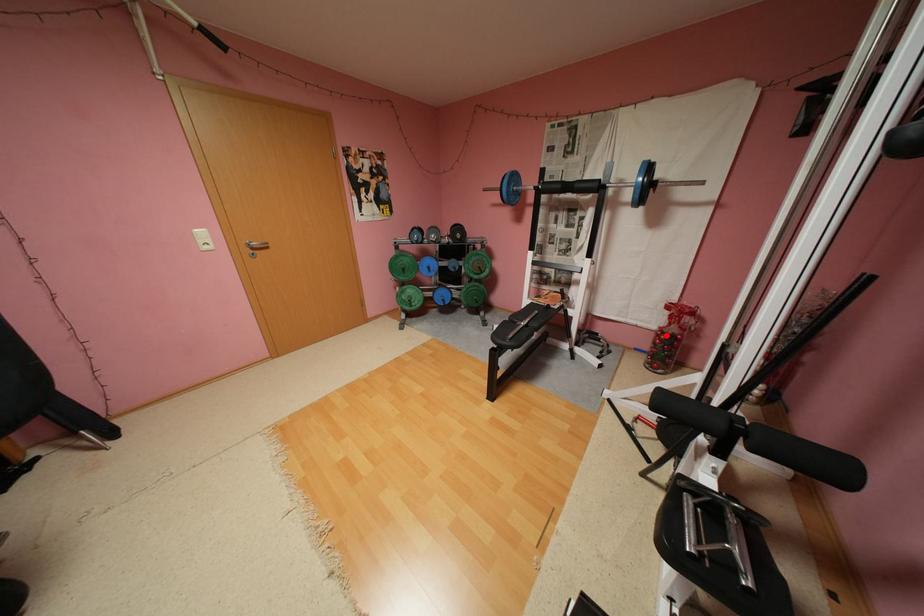
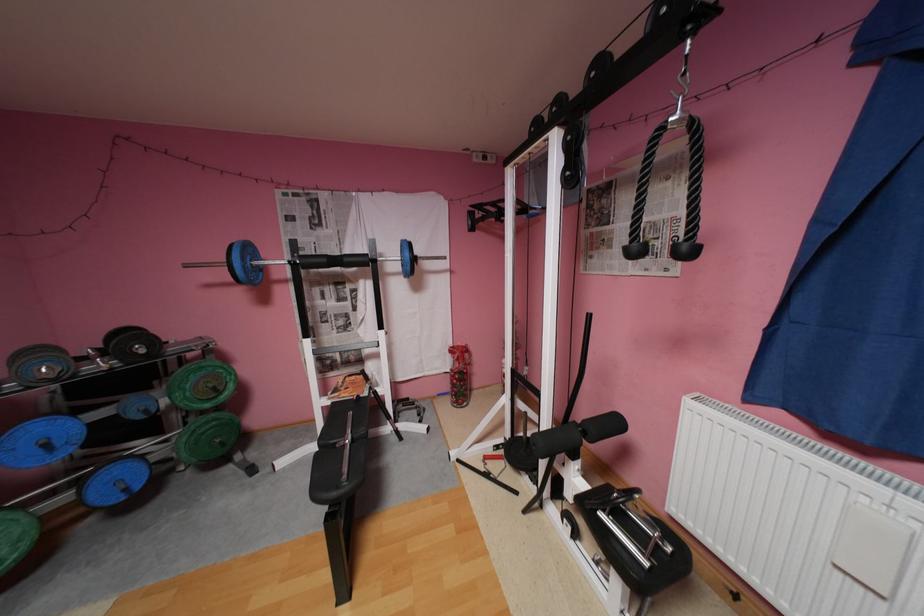
Question: A red point is marked in image1. In image2, is the corresponding 3D point closer to the camera or farther? Reply with the corresponding letter.

Choices:
 (A) The corresponding 3D point is closer.
 (B) The corresponding 3D point is farther.

Answer: (B)